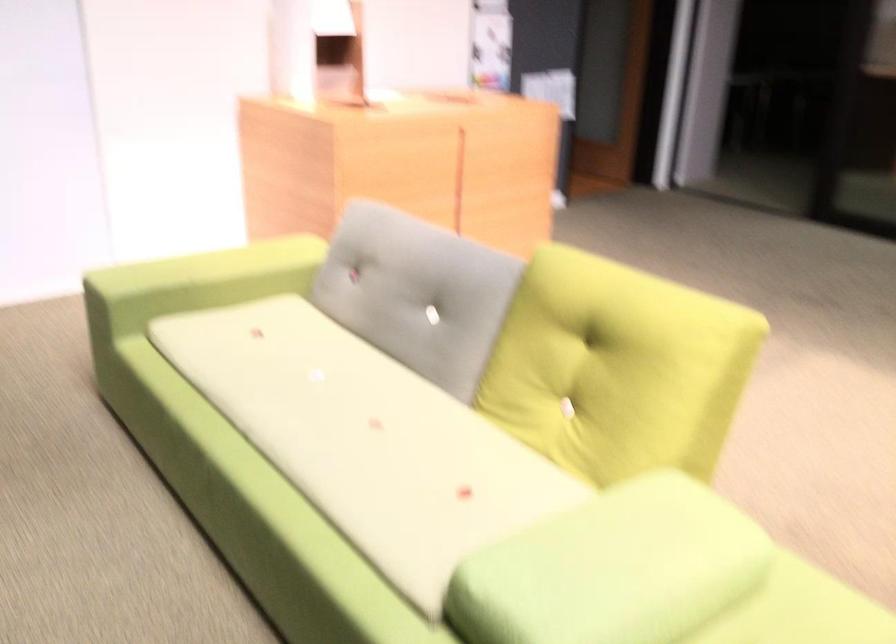
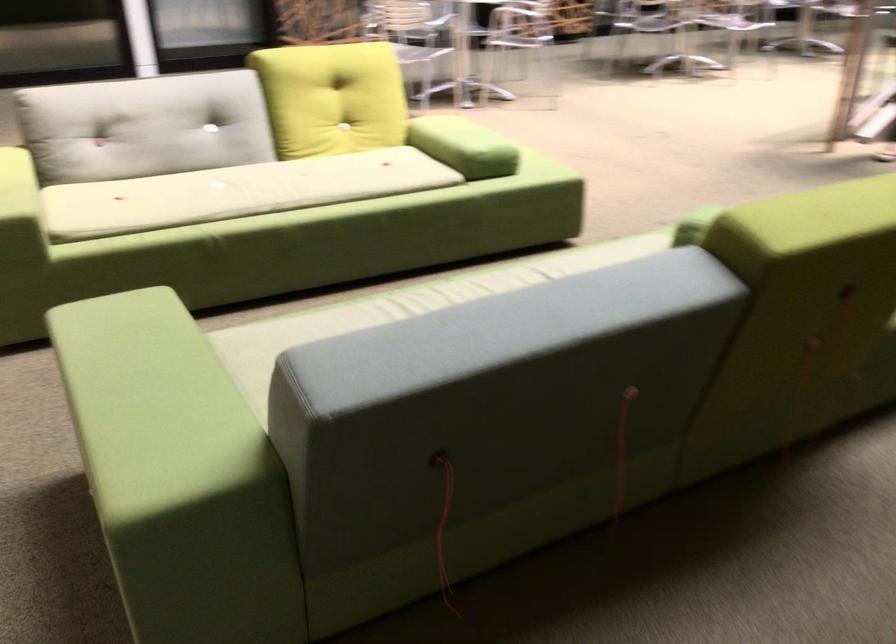
In the second image, find the point that corresponds to point (479, 554) in the first image.

(464, 146)